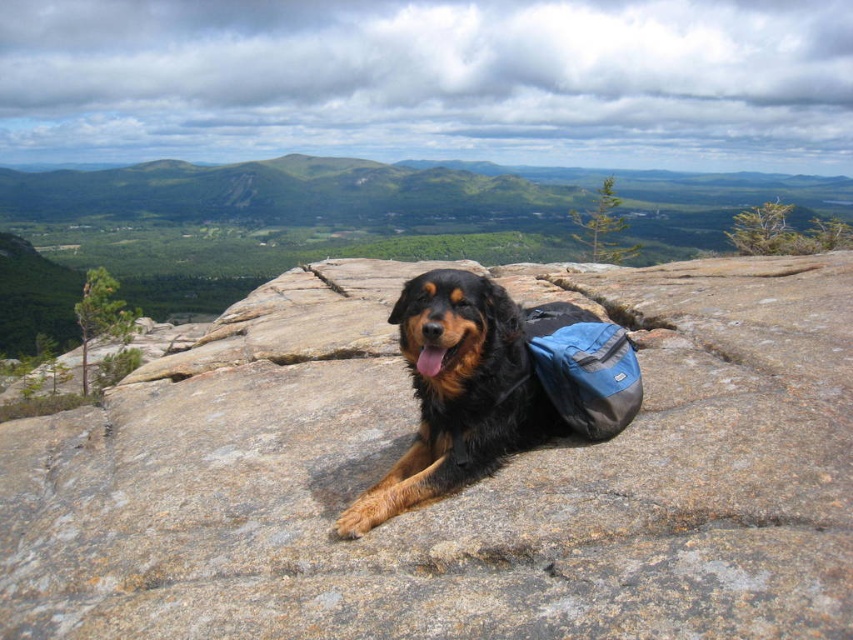
Is brown rough rock at center positioned in front of shiny brown fur at center?

That is True.

Who is more distant from viewer, (x=515, y=474) or (x=625, y=396)?

Point (x=625, y=396)

Where is `brown rough rock at center`? This screenshot has width=853, height=640. brown rough rock at center is located at coordinates (459, 492).